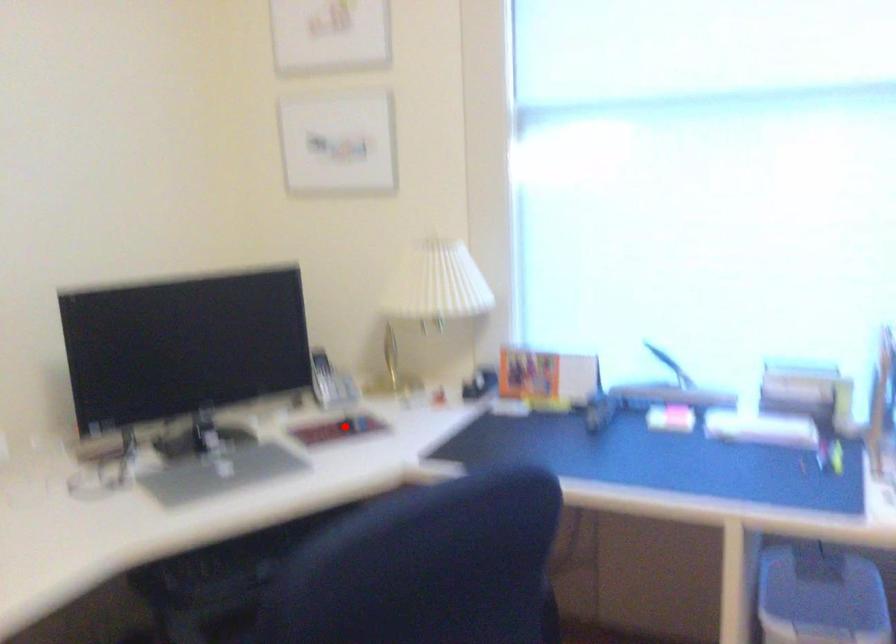
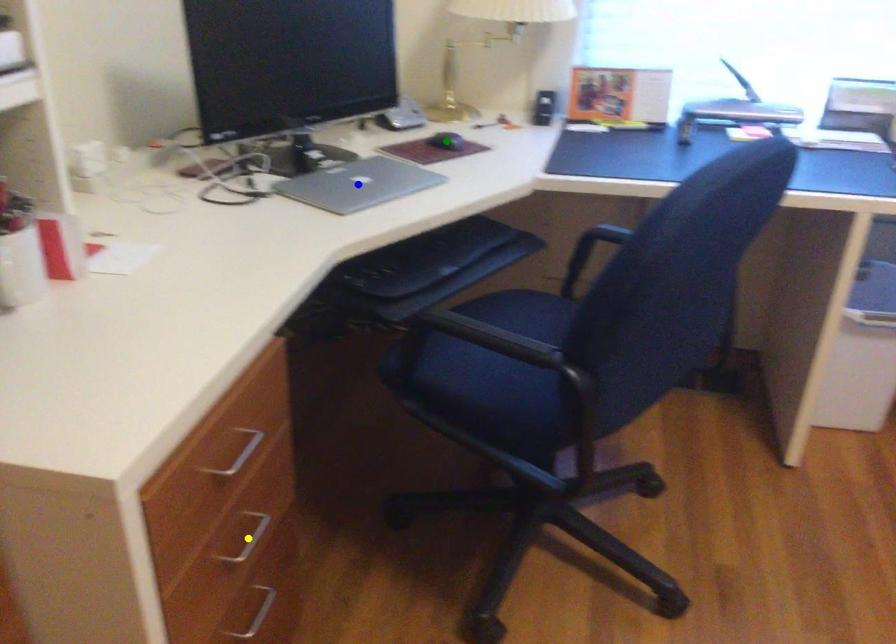
Question: I am providing you with two images of the same scene from different viewpoints. A red point is marked on the first image. You are given multiple points on the second image. Which spot in image 2 lines up with the point in image 1?

Choices:
 (A) green point
 (B) blue point
 (C) yellow point

Answer: (A)